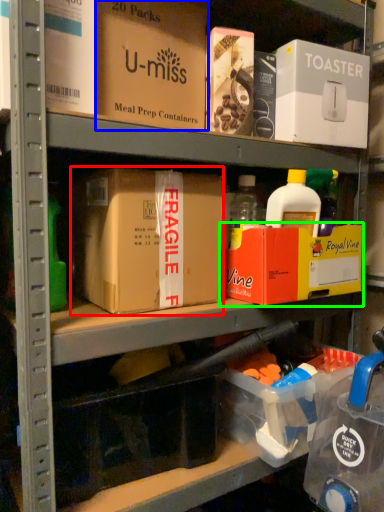
Question: Estimate the real-world distances between objects in this image. Which object is closer to box (highlighted by a red box), box (highlighted by a blue box) or box (highlighted by a green box)?

Choices:
 (A) box
 (B) box

Answer: (B)